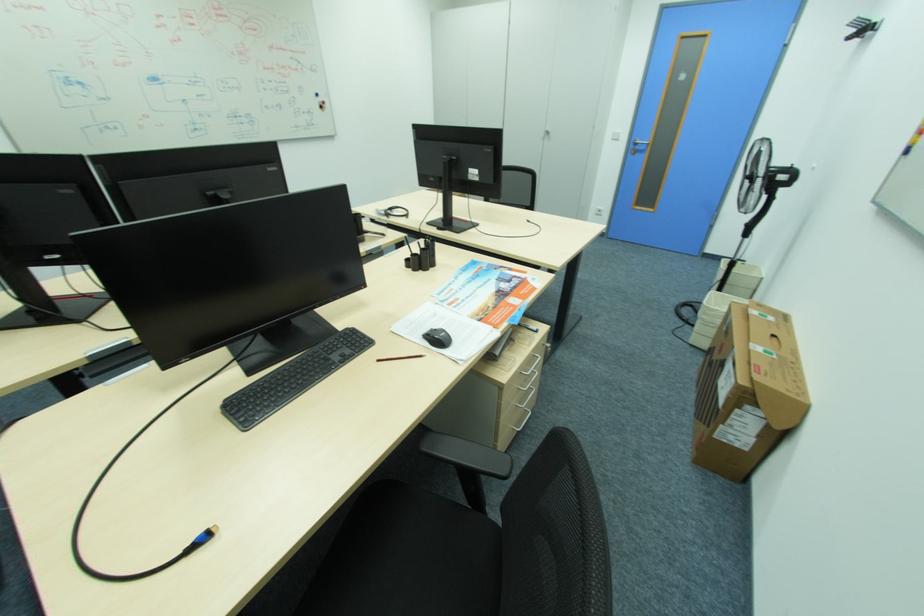
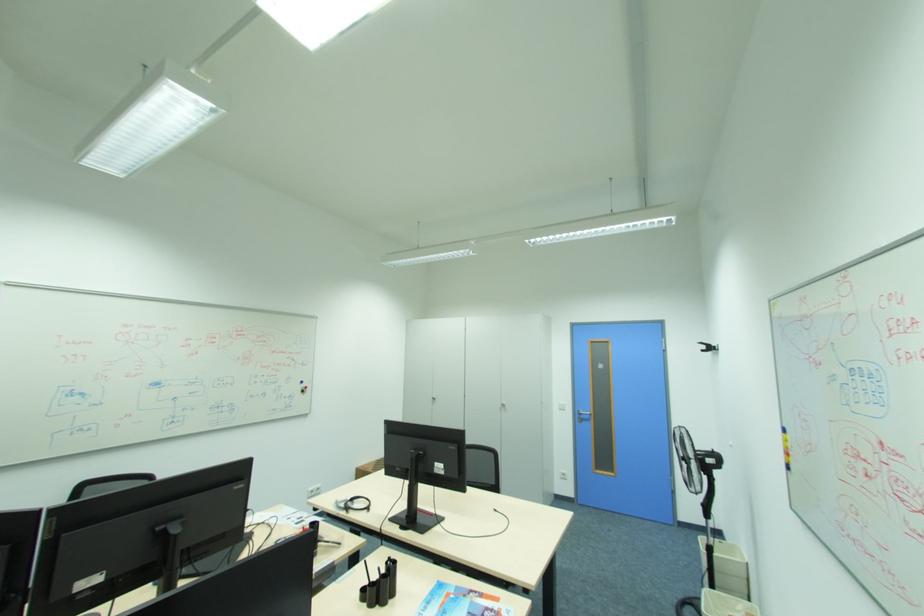
Find the pixel in the second image that matches (642,148) in the first image.

(588, 416)